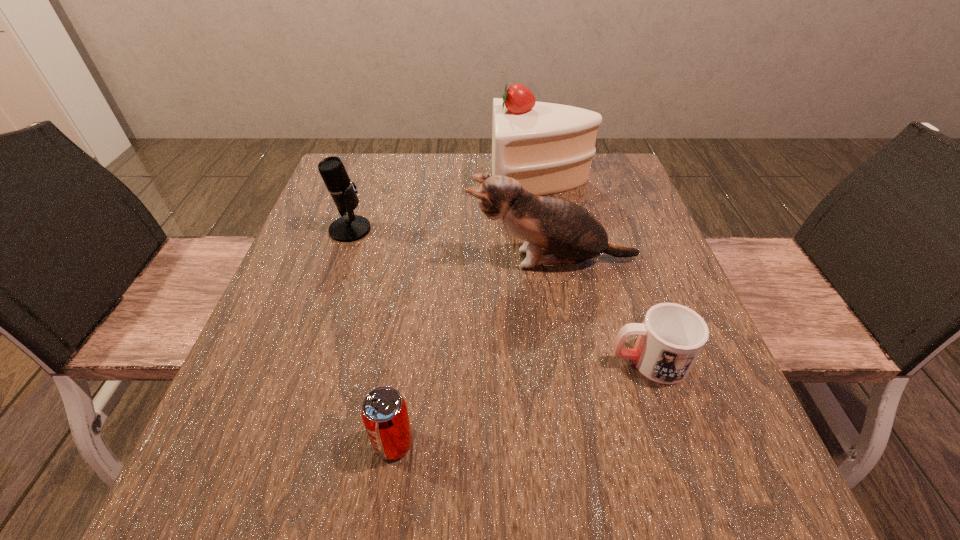
Image resolution: width=960 pixels, height=540 pixels. Find the location of `vacant point located at the face of the third nearest object`. vacant point located at the face of the third nearest object is located at coordinates pyautogui.click(x=316, y=260).

I want to click on vacant space located 0.050m at the face of the third nearest object, so click(x=444, y=260).

Find the location of a particular element. This screenshot has width=960, height=540. vacant region located 0.330m at the face of the third nearest object is located at coordinates (316, 260).

The image size is (960, 540). Identify the location of vacant space located on the back of the leftmost object. (359, 203).

Find the location of a particular element. Image resolution: width=960 pixels, height=540 pixels. free space located 0.330m on the back of the second shortest object is located at coordinates (418, 277).

The width and height of the screenshot is (960, 540). I want to click on vacant space positioned 0.190m on the side of the mug with the handle, so click(x=501, y=361).

Where is `blank space located 0.330m on the side of the mug with the handle`? This screenshot has height=540, width=960. blank space located 0.330m on the side of the mug with the handle is located at coordinates (421, 361).

At what (x,y) coordinates should I click in order to perform the action: click on vacant region located on the side of the mug with the handle. Please return your answer as a coordinate pair (x, y). This screenshot has width=960, height=540. Looking at the image, I should click on (513, 361).

You are a GUI agent. You are given a task and a screenshot of the screen. Output one action in this format:
    pyautogui.click(x=<x>, y=<y>)
    Task: Click on the object present at the far edge
    Image resolution: width=960 pixels, height=540 pixels.
    Given the screenshot: What is the action you would take?
    pyautogui.click(x=548, y=148)

What are the coordinates of `object that is at the near edge` in the screenshot? It's located at pos(384,412).